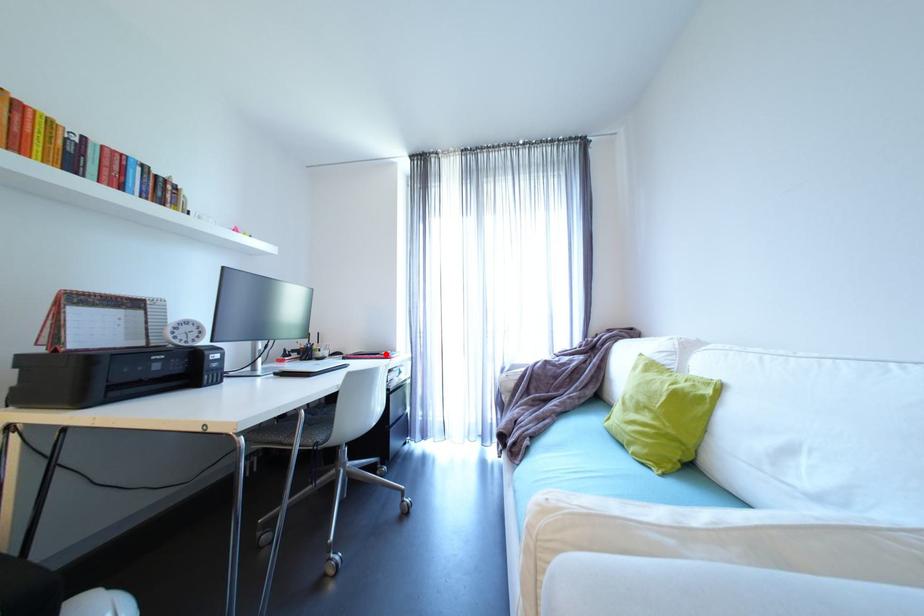
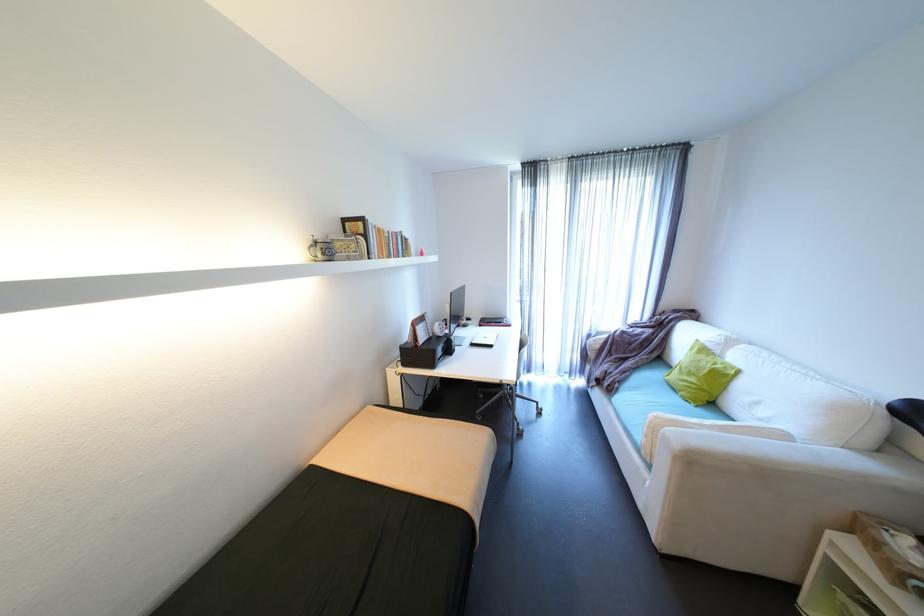
Where in the second image is the point corresponding to the highlighted location from the first image?

(508, 323)